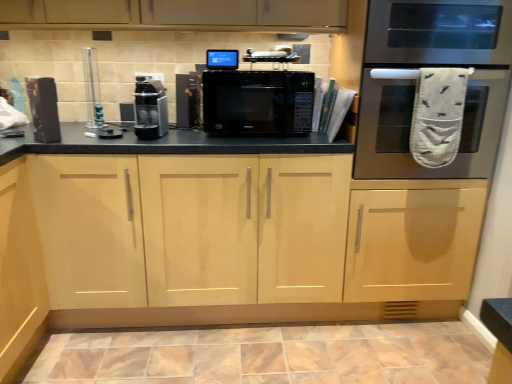
You are a GUI agent. You are given a task and a screenshot of the screen. Output one action in this format:
    pyautogui.click(x=<x>, y=<y>)
    Task: Click on the free spot to the right of blue glossy monitor at upper center, the first appliance viewed from the right
    The width and height of the screenshot is (512, 384).
    Given the screenshot: What is the action you would take?
    pyautogui.click(x=256, y=71)